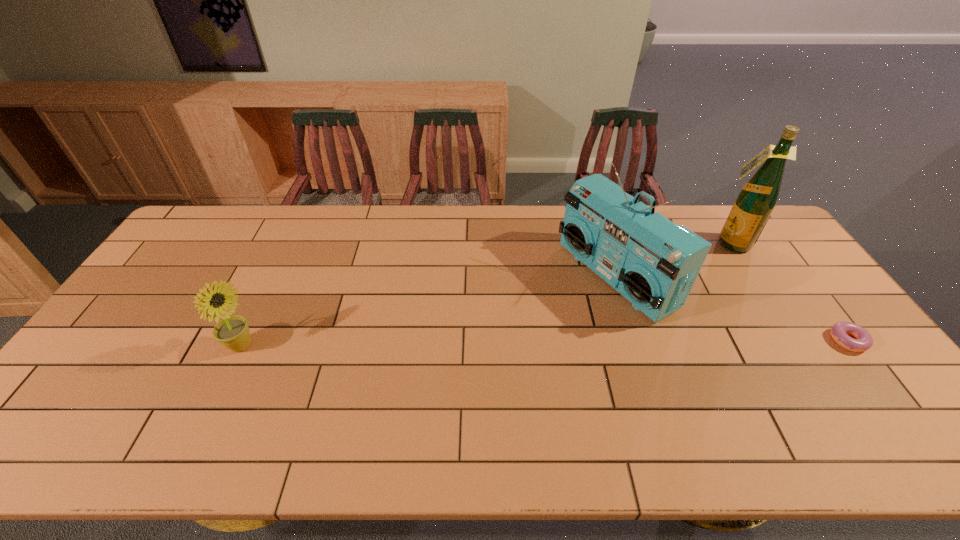
The width and height of the screenshot is (960, 540). In order to click on sunflower in this screenshot , I will do `click(233, 332)`.

You are a GUI agent. You are given a task and a screenshot of the screen. Output one action in this format:
    pyautogui.click(x=<x>, y=<y>)
    Task: Click on the third tallest object
    
    Given the screenshot: What is the action you would take?
    pyautogui.click(x=233, y=332)

Find the location of a particular element. This screenshot has height=540, width=960. the rightmost object is located at coordinates (863, 340).

The width and height of the screenshot is (960, 540). In order to click on the shortest object in this screenshot , I will do `click(863, 340)`.

Where is `the second object from left to right`? the second object from left to right is located at coordinates (652, 262).

Locate an element on the screen. The image size is (960, 540). radio receiver is located at coordinates (652, 262).

Identify the location of the tallest object. (755, 202).

Find the location of a particular element. liquor is located at coordinates (755, 202).

Where is `vacant space located on the face of the sunflower`? This screenshot has height=540, width=960. vacant space located on the face of the sunflower is located at coordinates (348, 346).

Find the location of `vacant space situated on the left of the rightmost object`. vacant space situated on the left of the rightmost object is located at coordinates (684, 341).